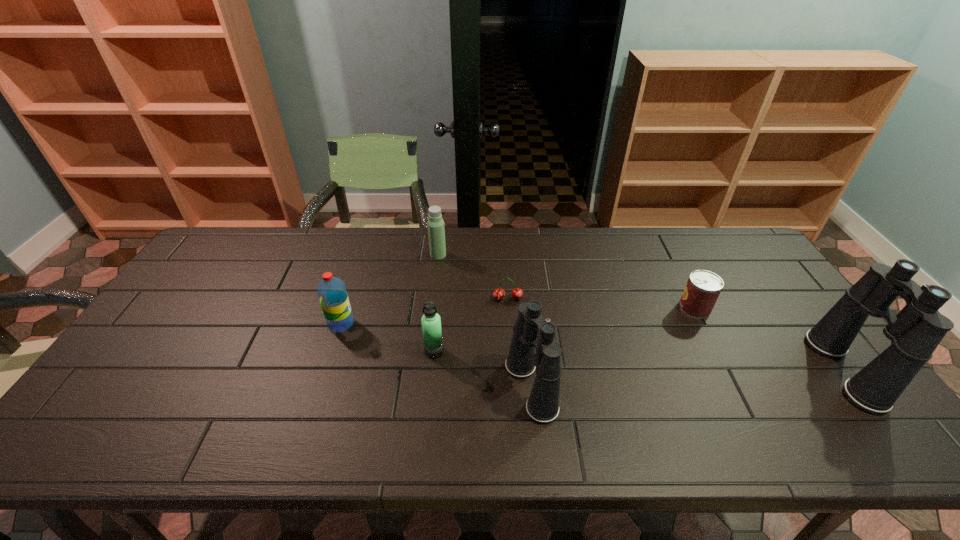
This screenshot has width=960, height=540. What are the coordinates of `vacant point at the far edge` in the screenshot? It's located at (649, 230).

Find the location of `vacant space at the near edge of the desktop`. vacant space at the near edge of the desktop is located at coordinates (711, 409).

Find the location of `vacant space at the left edge of the desktop`. vacant space at the left edge of the desktop is located at coordinates (215, 287).

The width and height of the screenshot is (960, 540). I want to click on vacant area at the far left corner, so 250,235.

Where is `vacant space at the near right corner of the desktop`? The width and height of the screenshot is (960, 540). vacant space at the near right corner of the desktop is located at coordinates (795, 395).

The height and width of the screenshot is (540, 960). In order to click on free space between the left binoculars and the farthest object in this screenshot , I will do `click(485, 321)`.

Locate an element on the screen. free point between the nearer thermos bottle and the leftmost object is located at coordinates (388, 338).

Find the location of a particular element. The image size is (960, 540). vacant area between the shortest object and the rightmost object is located at coordinates (676, 334).

Image resolution: width=960 pixels, height=540 pixels. What are the coordinates of `free spot between the farthest object and the second shortest object` in the screenshot? It's located at (566, 281).

I want to click on vacant space in between the nearer thermos bottle and the left binoculars, so click(483, 369).